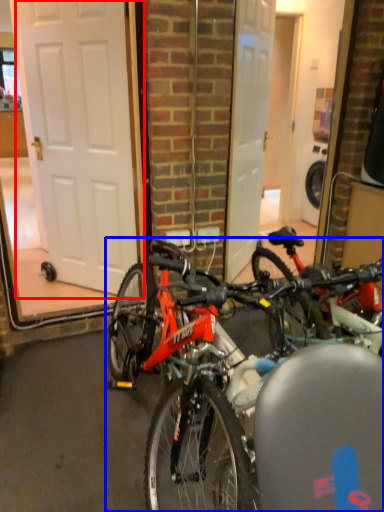
Question: Which of the following is the farthest to the observer, door (highlighted by a red box) or bicycle (highlighted by a blue box)?

Choices:
 (A) door
 (B) bicycle

Answer: (A)